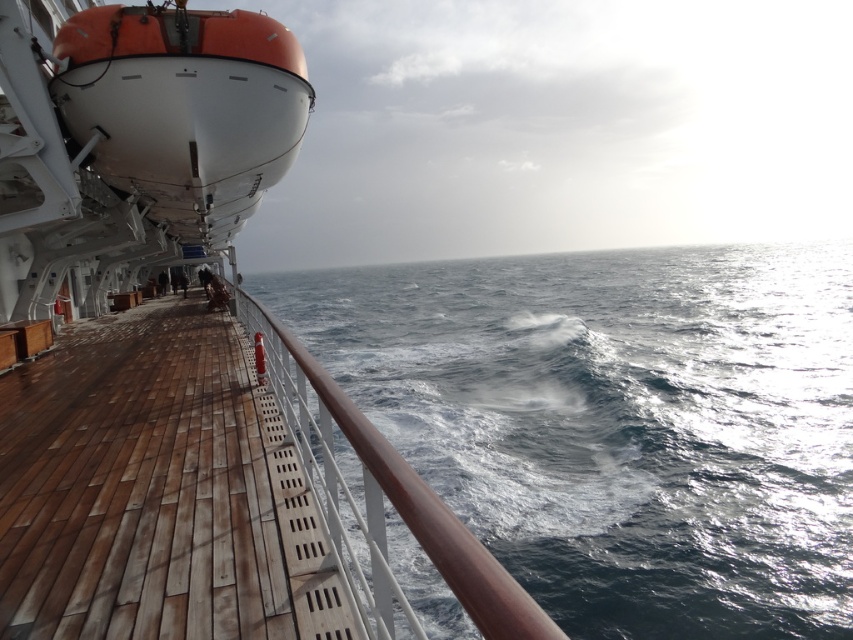
Can you confirm if orange matte lifeboat at upper left is smaller than brown wooden deck at center?

No.

Who is more forward, (x=361, y=483) or (x=155, y=444)?

Point (x=155, y=444) is more forward.

Find the location of a particular element. orange matte lifeboat at upper left is located at coordinates (184, 364).

Who is taller, orange matte lifeboat at upper left or blue water at center?

Standing taller between the two is blue water at center.

In the scene shown: Can you confirm if orange matte lifeboat at upper left is positioned to the right of blue water at center?

Incorrect, orange matte lifeboat at upper left is not on the right side of blue water at center.

Locate an element on the screen. orange matte lifeboat at upper left is located at coordinates (184, 364).

Does blue water at center have a lesser height compared to brown wooden deck at center?

No, blue water at center is not shorter than brown wooden deck at center.

Is blue water at center positioned in front of brown wooden deck at center?

No.

Where is `blue water at center`? Image resolution: width=853 pixels, height=640 pixels. blue water at center is located at coordinates (619, 422).

Find the location of a particular element. The height and width of the screenshot is (640, 853). blue water at center is located at coordinates (619, 422).